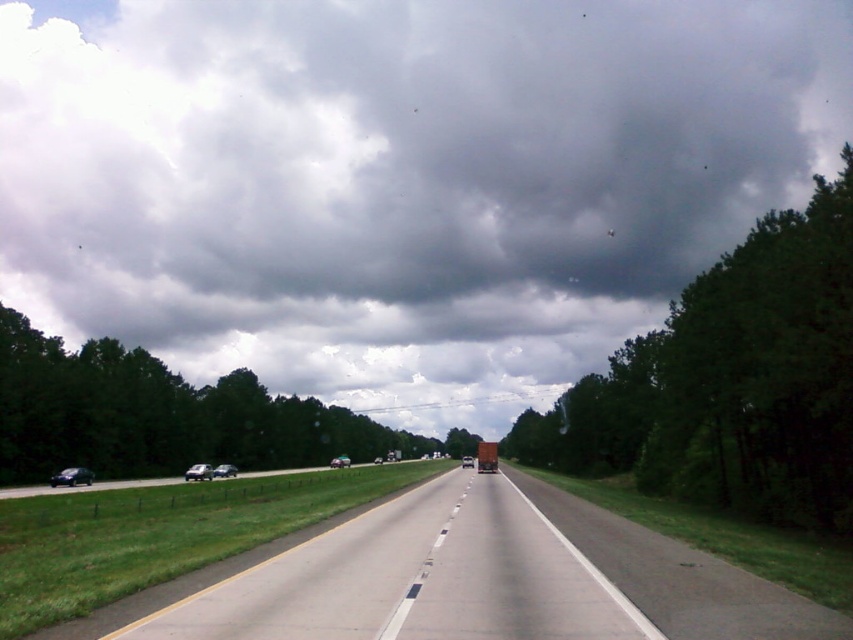
You are a photographer standing at the edge of the highway. You want to take a photo that includes both point (56, 483) and point (206, 467). Which point will appear larger in your photo?

Point (56, 483) will appear larger in the photo because it is closer to the camera than point (206, 467).

You are a drone operator preparing to fly a drone 200 meters away from the camera. Based on the scene, will the dark gray cloud at upper center be within your drone flight range?

The dark gray cloud at upper center and camera are 252.74 meters apart from each other. Since the drone is set to fly 200 meters away from the camera, the dark gray cloud at upper center is beyond the drone flight range by 52.74 meters.

You are a pedestrian standing at the edge of the highway near the shiny black car at lower left and the shiny silver sedan at left. You want to cross the highway to reach the trees on the opposite side. Which vehicle should you cross in front of to stay as close as possible to the left side of the road?

You should cross in front of the shiny black car at lower left because it is positioned to the left of the shiny silver sedan at left, keeping you closer to the left side of the road.